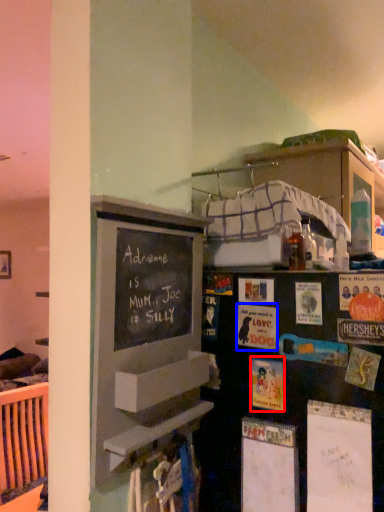
Question: Which object appears farthest to the camera in this image, postcard (highlighted by a red box) or postcard (highlighted by a blue box)?

Choices:
 (A) postcard
 (B) postcard

Answer: (B)